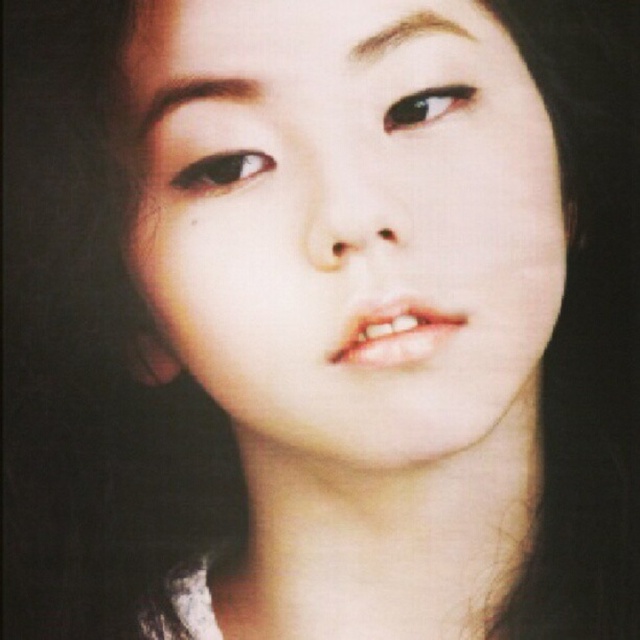
Question: Which object is positioned farthest from the brown glossy eye at upper center?

Choices:
 (A) brown matte eye at center
 (B) smooth skin face at center

Answer: (A)

Question: Which object is positioned closest to the smooth skin face at center?

Choices:
 (A) brown glossy eye at upper center
 (B) brown matte eye at center

Answer: (B)

Question: Which of the following is the farthest from the observer?

Choices:
 (A) (227, 152)
 (B) (408, 170)
 (C) (435, 100)

Answer: (C)

Question: Can you confirm if smooth skin face at center is positioned below brown matte eye at center?

Choices:
 (A) no
 (B) yes

Answer: (B)

Question: Does brown matte eye at center lie in front of brown glossy eye at upper center?

Choices:
 (A) yes
 (B) no

Answer: (B)

Question: Is smooth skin face at center wider than brown glossy eye at upper center?

Choices:
 (A) no
 (B) yes

Answer: (B)